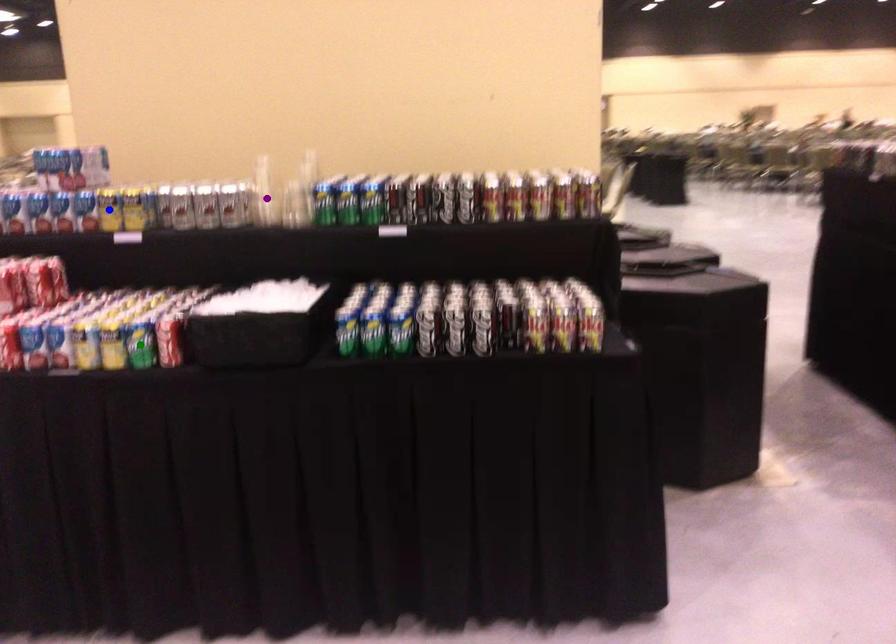
Order these from nearest to farthest:
A) green point
B) blue point
C) purple point

1. green point
2. blue point
3. purple point